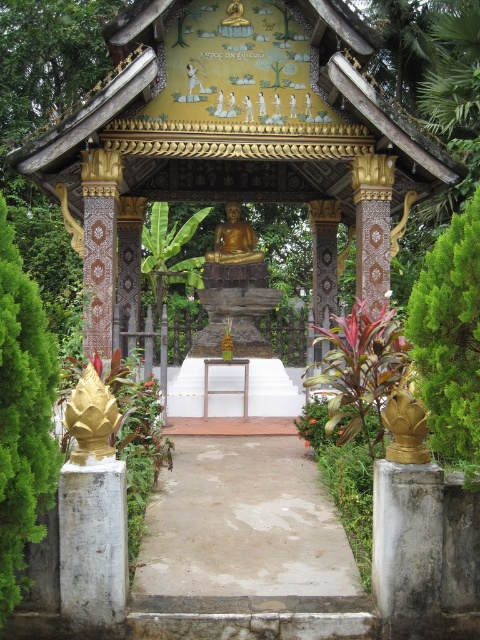
You are a visitor at the temple and want to take a photo of the gold painted wood gazebo at center without any obstructions. Is the green leafy bush at right blocking your view of the gazebo?

The green leafy bush at right is behind the gold painted wood gazebo at center, so it won not block your view of the gazebo.